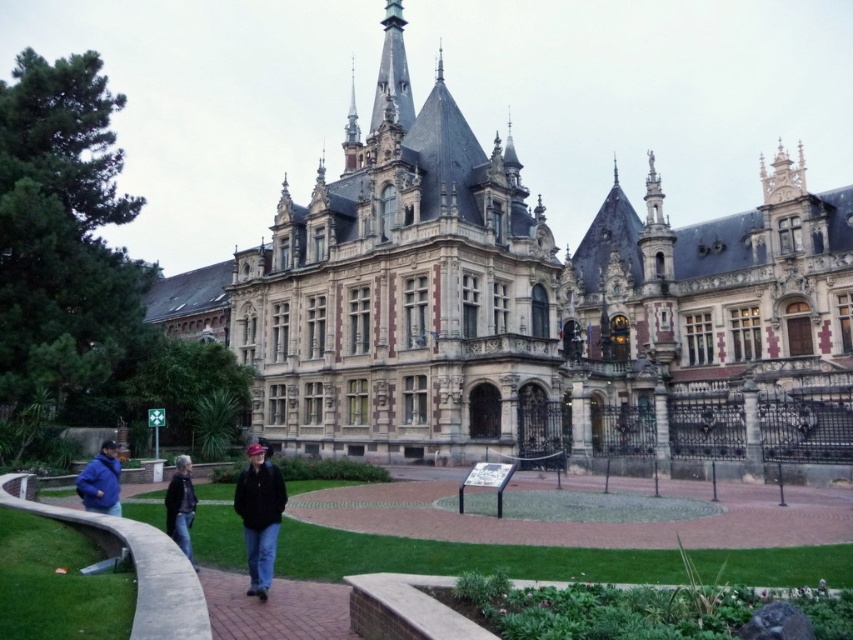
The height and width of the screenshot is (640, 853). I want to click on stone castle at center, so click(x=529, y=308).

Which is more to the left, stone castle at center or blue matte jacket at lower left?

From the viewer's perspective, blue matte jacket at lower left appears more on the left side.

Describe the element at coordinates (529, 308) in the screenshot. This screenshot has height=640, width=853. I see `stone castle at center` at that location.

The width and height of the screenshot is (853, 640). Identify the location of stone castle at center. (529, 308).

Between stone castle at center and dark gray jacket at center, which one is positioned higher?

stone castle at center is higher up.

Can you confirm if stone castle at center is positioned to the left of dark gray jacket at center?

No, stone castle at center is not to the left of dark gray jacket at center.

Describe the element at coordinates (529, 308) in the screenshot. This screenshot has width=853, height=640. I see `stone castle at center` at that location.

The height and width of the screenshot is (640, 853). I want to click on stone castle at center, so click(x=529, y=308).

Is green grass at lower center below blue matte jacket at lower left?

Yes.

Identify the location of green grass at lower center. (198, 588).

Which is behind, point (57, 513) or point (100, 488)?

Positioned behind is point (100, 488).

Locate an element on the screen. The width and height of the screenshot is (853, 640). green grass at lower center is located at coordinates (198, 588).